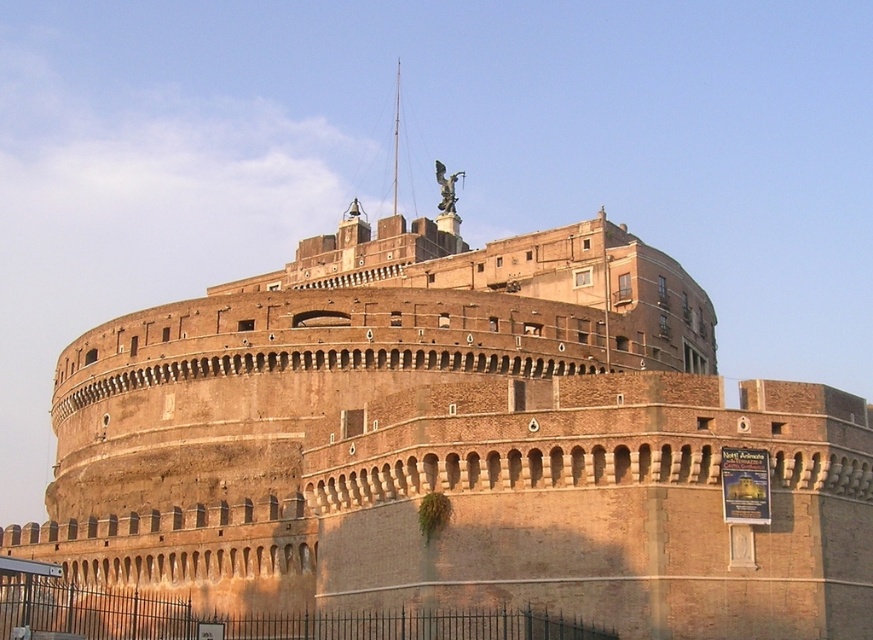
Who is lower down, black wrought iron fence at lower center or bronze statue at upper center?

black wrought iron fence at lower center is lower down.

Image resolution: width=873 pixels, height=640 pixels. What do you see at coordinates (253, 618) in the screenshot?
I see `black wrought iron fence at lower center` at bounding box center [253, 618].

At what (x,y) coordinates should I click in order to perform the action: click on black wrought iron fence at lower center. Please return your answer as a coordinate pair (x, y). The width and height of the screenshot is (873, 640). Looking at the image, I should click on (253, 618).